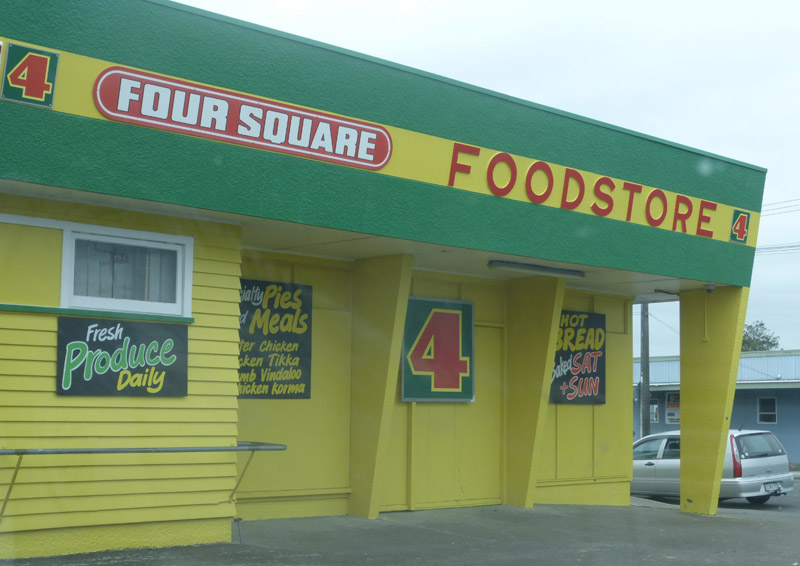
Where is `light`? light is located at coordinates (520, 270).